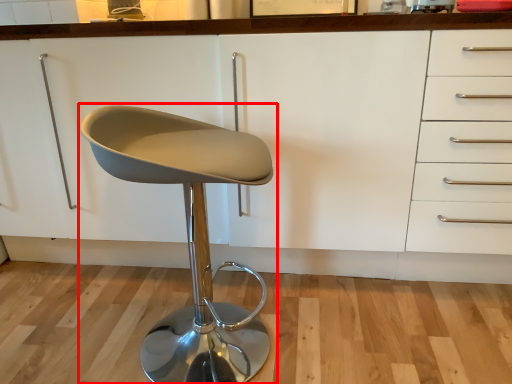
Question: In this image, where is chair (annotated by the red box) located relative to cabinetry?

Choices:
 (A) right
 (B) left

Answer: (B)